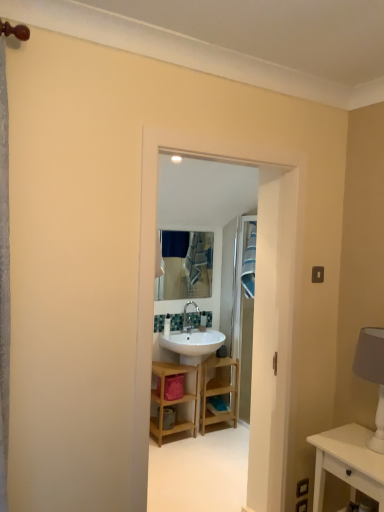
Question: Considering the relative sizes of wooden shelf at center and white glossy sink at center in the image provided, is wooden shelf at center wider than white glossy sink at center?

Choices:
 (A) yes
 (B) no

Answer: (A)

Question: Is the position of wooden shelf at center less distant than that of white glossy sink at center?

Choices:
 (A) no
 (B) yes

Answer: (A)

Question: Is white glossy sink at center a part of wooden shelf at center?

Choices:
 (A) yes
 (B) no

Answer: (B)

Question: From the image's perspective, is wooden shelf at center below white glossy sink at center?

Choices:
 (A) no
 (B) yes

Answer: (B)

Question: Is wooden shelf at center shorter than white glossy sink at center?

Choices:
 (A) no
 (B) yes

Answer: (B)

Question: In terms of width, does wooden shelf at center look wider or thinner when compared to white glossy sink at center?

Choices:
 (A) wide
 (B) thin

Answer: (A)

Question: From a real-world perspective, relative to white glossy sink at center, is wooden shelf at center vertically above or below?

Choices:
 (A) above
 (B) below

Answer: (B)

Question: Does point (195, 433) appear closer or farther from the camera than point (274, 334)?

Choices:
 (A) closer
 (B) farther

Answer: (B)

Question: Based on their positions, is wooden shelf at center located to the left or right of white glossy sink at center?

Choices:
 (A) left
 (B) right

Answer: (A)

Question: From the image's perspective, is white glossy sink at center located above or below white fabric lampshade at right?

Choices:
 (A) below
 (B) above

Answer: (B)

Question: From a real-world perspective, relative to white fabric lampshade at right, is white glossy sink at center vertically above or below?

Choices:
 (A) above
 (B) below

Answer: (A)

Question: Considering the positions of white glossy sink at center and white fabric lampshade at right in the image, is white glossy sink at center wider or thinner than white fabric lampshade at right?

Choices:
 (A) wide
 (B) thin

Answer: (B)

Question: Based on their positions, is white glossy sink at center located to the left or right of white fabric lampshade at right?

Choices:
 (A) left
 (B) right

Answer: (A)

Question: From a real-world perspective, is white fabric lampshade at right physically located above or below wooden shelf at center?

Choices:
 (A) above
 (B) below

Answer: (A)

Question: Considering the positions of white fabric lampshade at right and wooden shelf at center in the image, is white fabric lampshade at right taller or shorter than wooden shelf at center?

Choices:
 (A) tall
 (B) short

Answer: (B)